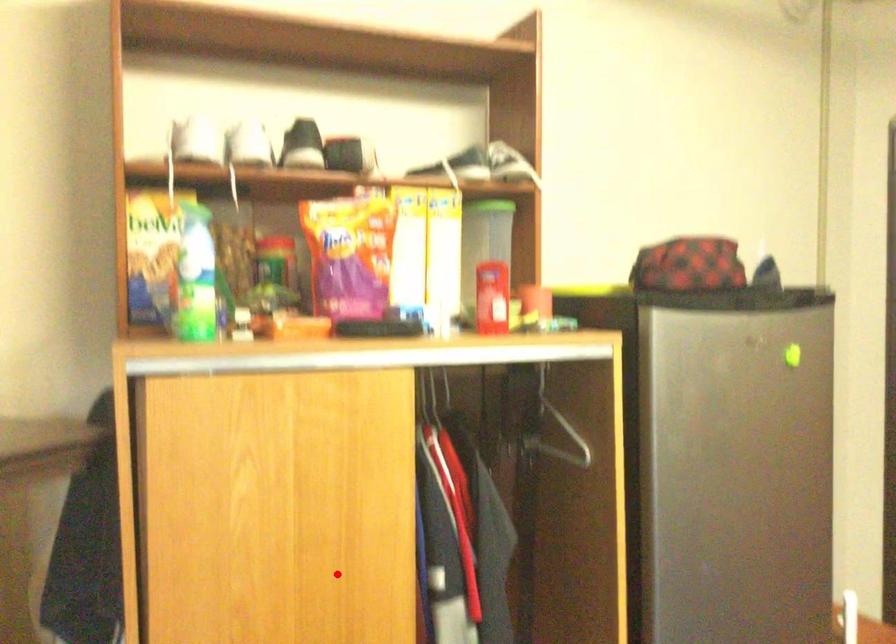
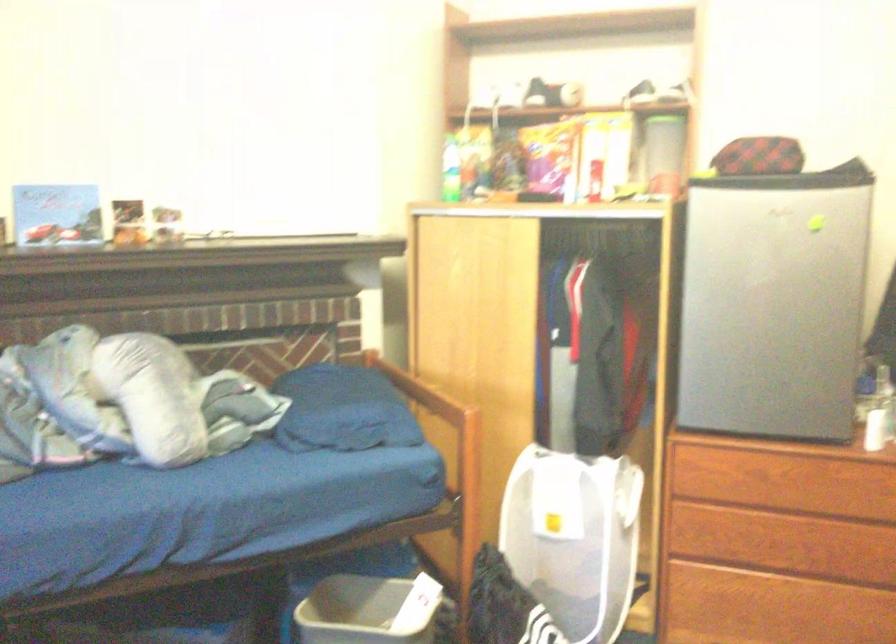
Question: I am providing you with two images of the same scene from different viewpoints. Image1 has a red point marked. In image2, the corresponding 3D location appears at what relative position? Reply with the corresponding letter.

Choices:
 (A) Closer
 (B) Farther

Answer: (B)